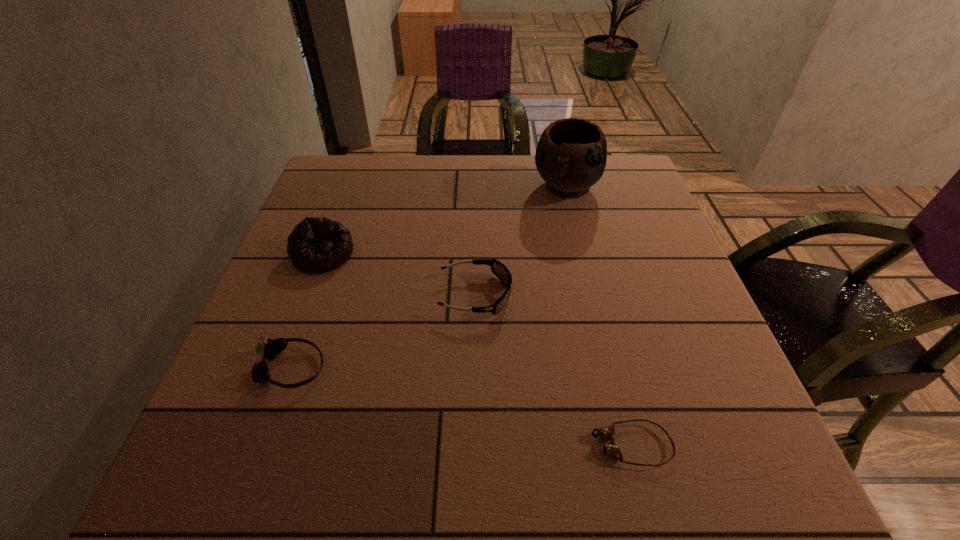
You are a GUI agent. You are given a task and a screenshot of the screen. Output one action in this format:
    pyautogui.click(x=<x>, y=<y>)
    Task: Click on the object that is the second nearest to the leftmost goggles
    Image resolution: width=960 pixels, height=540 pixels.
    Given the screenshot: What is the action you would take?
    pyautogui.click(x=499, y=269)

I want to click on goggles object that ranks as the third closest to the beanbag, so click(612, 449).

Identify which goggles is the nearest to the nearest object. Please provide its 2D coordinates. Your answer should be formatted as a tuple, i.e. [(x, y)], where the tuple contains the x and y coordinates of a point satisfying the conditions above.

[(499, 269)]

Locate an element on the screen. This screenshot has height=540, width=960. vacant position in the image that satisfies the following two spatial constraints: 1. on the front side of the farthest object; 2. through the lenses of the leftmost goggles is located at coordinates (611, 368).